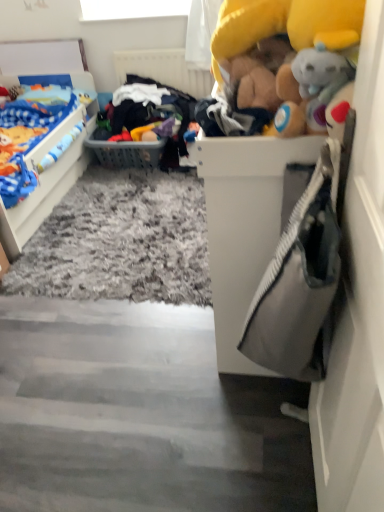
Identify the location of shaggy carpet at lower center. (139, 414).

The width and height of the screenshot is (384, 512). Describe the element at coordinates (287, 56) in the screenshot. I see `yellow plush toy at upper right, the 1th toy positioned from the right` at that location.

The width and height of the screenshot is (384, 512). I want to click on white matte door at right, so click(357, 309).

Describe the element at coordinates (357, 309) in the screenshot. I see `white matte door at right` at that location.

Where is `gray plastic basket at center`? This screenshot has width=384, height=512. gray plastic basket at center is located at coordinates (125, 151).

Locate an element on the screen. This screenshot has height=512, width=384. shaggy carpet at lower center is located at coordinates (139, 414).

Looking at this image, considering the positions of objects white textured radiator at upper center and gray plastic basket at center in the image provided, who is behind, white textured radiator at upper center or gray plastic basket at center?

Positioned behind is white textured radiator at upper center.

From the image's perspective, is white textured radiator at upper center beneath gray plastic basket at center?

Actually, white textured radiator at upper center appears above gray plastic basket at center in the image.

In the image, is white textured radiator at upper center on the left side or the right side of gray plastic basket at center?

white textured radiator at upper center is positioned on gray plastic basket at center's right side.

Is white textured radiator at upper center positioned beyond the bounds of gray plastic basket at center?

Yes, white textured radiator at upper center is not within gray plastic basket at center.

Is white textured radiator at upper center completely or partially inside matte blue blanket at left, acting as the second toy starting from the right?

No, white textured radiator at upper center is not inside matte blue blanket at left, acting as the second toy starting from the right.

Is point (22, 115) closer to camera compared to point (132, 71)?

That is True.

Can you tell me how much matte blue blanket at left, acting as the second toy starting from the right, and white textured radiator at upper center differ in facing direction?

The angular difference between matte blue blanket at left, acting as the second toy starting from the right, and white textured radiator at upper center is 88.6 degrees.

Which object is positioned more to the left, matte blue blanket at left, acting as the 1th toy starting from the left, or white textured radiator at upper center?

matte blue blanket at left, acting as the 1th toy starting from the left.

Can you confirm if shaggy carpet at lower center is bigger than white textured radiator at upper center?

Yes.

Is shaggy carpet at lower center positioned before white textured radiator at upper center?

Yes.

Could white textured radiator at upper center be considered to be inside shaggy carpet at lower center?

Actually, white textured radiator at upper center is outside shaggy carpet at lower center.

Who is taller, shaggy carpet at lower center or white textured radiator at upper center?

white textured radiator at upper center.

Is shaggy carpet at lower center inside the boundaries of white matte door at right, or outside?

shaggy carpet at lower center is spatially situated outside white matte door at right.

Is shaggy carpet at lower center next to white matte door at right and touching it?

No, shaggy carpet at lower center is not beside white matte door at right.

Considering the relative positions of matte blue blanket at left, positioned as the 1th toy in back-to-front order, and white matte door at right in the image provided, is matte blue blanket at left, positioned as the 1th toy in back-to-front order, to the right of white matte door at right from the viewer's perspective?

No.

How different are the orientations of matte blue blanket at left, positioned as the 1th toy in back-to-front order, and white matte door at right in degrees?

There is a 177-degree angle between the facing directions of matte blue blanket at left, positioned as the 1th toy in back-to-front order, and white matte door at right.

From a real-world perspective, between matte blue blanket at left, positioned as the 1th toy in back-to-front order, and white matte door at right, who is vertically lower?

matte blue blanket at left, positioned as the 1th toy in back-to-front order.

Is matte blue blanket at left, acting as the 1th toy starting from the left, beside white matte door at right?

No, matte blue blanket at left, acting as the 1th toy starting from the left, is not making contact with white matte door at right.

How much distance is there between yellow plush toy at upper right, which appears as the second toy when viewed from the left, and shaggy carpet at lower center?

They are 3.56 feet apart.

From the picture: Is yellow plush toy at upper right, which appears as the second toy when viewed from the left, positioned before shaggy carpet at lower center?

Yes, yellow plush toy at upper right, which appears as the second toy when viewed from the left, is in front of shaggy carpet at lower center.

From a real-world perspective, is yellow plush toy at upper right, the 1th toy positioned from the right, physically located above or below shaggy carpet at lower center?

yellow plush toy at upper right, the 1th toy positioned from the right, is above shaggy carpet at lower center.

Is yellow plush toy at upper right, the first toy in the front-to-back sequence, not within shaggy carpet at lower center?

Yes.

From a real-world perspective, is white matte door at right below yellow plush toy at upper right, the 1th toy positioned from the right?

Yes, from a real-world perspective, white matte door at right is under yellow plush toy at upper right, the 1th toy positioned from the right.

From the white matte door at right, count the 1st toy to the left and point to it. Please provide its 2D coordinates.

[(287, 56)]

Does white matte door at right have a greater height compared to yellow plush toy at upper right, the second toy from the back?

Indeed, white matte door at right has a greater height compared to yellow plush toy at upper right, the second toy from the back.

From the image's perspective, is white matte door at right on yellow plush toy at upper right, the first toy in the front-to-back sequence?

No, from the image's perspective, white matte door at right is not over yellow plush toy at upper right, the first toy in the front-to-back sequence.

The height and width of the screenshot is (512, 384). I want to click on radiator above the gray plastic basket at center (from a real-world perspective), so click(164, 69).

Find the location of a particular element. radiator that appears on the right of matte blue blanket at left, acting as the 1th toy starting from the left is located at coordinates (164, 69).

Consider the image. When comparing their distances from white matte door at right, does white textured radiator at upper center or gray plastic basket at center seem further?

white textured radiator at upper center is further to white matte door at right.

From the image, which object appears to be nearer to matte blue blanket at left, positioned as the 1th toy in back-to-front order, white matte door at right or gray plastic basket at center?

gray plastic basket at center.

When comparing their distances from gray plastic basket at center, does yellow plush toy at upper right, the second toy from the back, or shaggy carpet at lower center seem closer?

Among the two, shaggy carpet at lower center is located nearer to gray plastic basket at center.

Estimate the real-world distances between objects in this image. Which object is further from gray plastic basket at center, white textured radiator at upper center or yellow plush toy at upper right, the 1th toy positioned from the right?

yellow plush toy at upper right, the 1th toy positioned from the right, lies further to gray plastic basket at center than the other object.

Based on their spatial positions, is matte blue blanket at left, positioned as the 1th toy in back-to-front order, or white textured radiator at upper center closer to yellow plush toy at upper right, which appears as the second toy when viewed from the left?

The object closer to yellow plush toy at upper right, which appears as the second toy when viewed from the left, is matte blue blanket at left, positioned as the 1th toy in back-to-front order.

Based on their spatial positions, is shaggy carpet at lower center or gray plastic basket at center further from white textured radiator at upper center?

Based on the image, shaggy carpet at lower center appears to be further to white textured radiator at upper center.

Looking at the image, which one is located closer to shaggy carpet at lower center, white matte door at right or yellow plush toy at upper right, the 1th toy positioned from the right?

white matte door at right is positioned closer to the anchor shaggy carpet at lower center.

Which object lies further to the anchor point shaggy carpet at lower center, white textured radiator at upper center or gray plastic basket at center?

white textured radiator at upper center lies further to shaggy carpet at lower center than the other object.

Where is `toy between yellow plush toy at upper right, the 1th toy positioned from the right, and gray plastic basket at center in the front-back direction`? toy between yellow plush toy at upper right, the 1th toy positioned from the right, and gray plastic basket at center in the front-back direction is located at coordinates (32, 135).

Where is `toy located between shaggy carpet at lower center and gray plastic basket at center in the depth direction`? This screenshot has width=384, height=512. toy located between shaggy carpet at lower center and gray plastic basket at center in the depth direction is located at coordinates (32, 135).

At what (x,y) coordinates should I click in order to perform the action: click on toy between white matte door at right and matte blue blanket at left, acting as the second toy starting from the right, in the front-back direction. Please return your answer as a coordinate pair (x, y). Looking at the image, I should click on (287, 56).

Where is `toy between shaggy carpet at lower center and white textured radiator at upper center from front to back`? This screenshot has height=512, width=384. toy between shaggy carpet at lower center and white textured radiator at upper center from front to back is located at coordinates (32, 135).